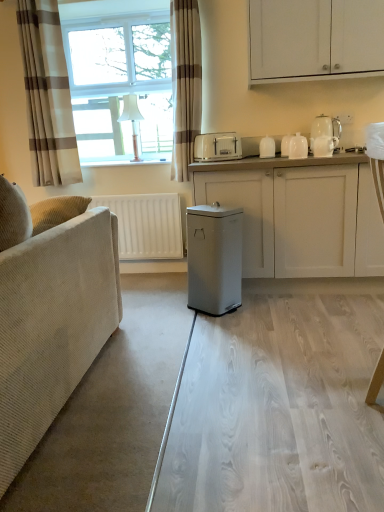
Find the location of a particular element. free spot above white matte radiator at left (from a real-world perspective) is located at coordinates (127, 192).